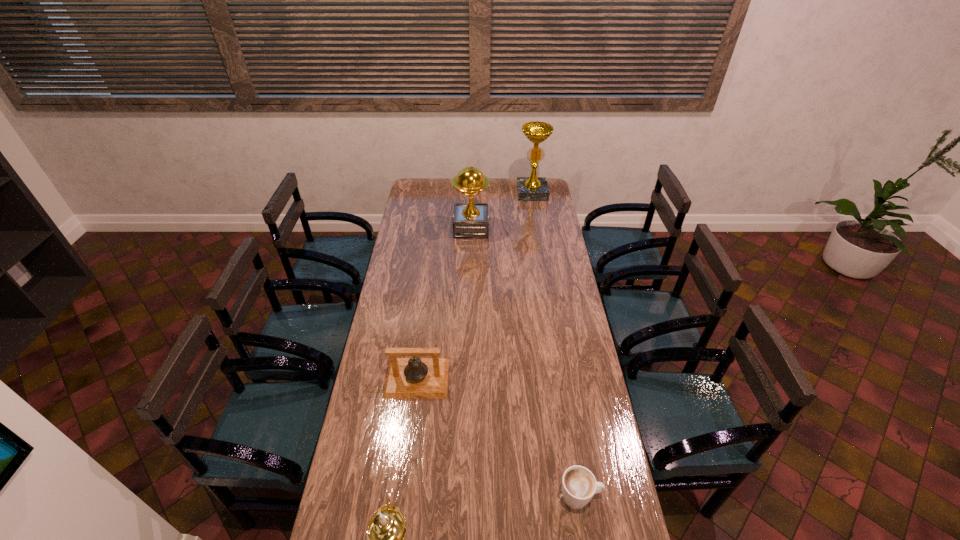
Where is `the right award`? the right award is located at coordinates (533, 188).

I want to click on the farther award, so click(533, 188).

Locate an element on the screen. the second farthest object is located at coordinates (470, 220).

Find the location of a particular element. This screenshot has height=540, width=960. the left award is located at coordinates (470, 220).

The width and height of the screenshot is (960, 540). Find the location of `bell`. bell is located at coordinates (407, 378).

The width and height of the screenshot is (960, 540). I want to click on the third shortest object, so click(407, 378).

The width and height of the screenshot is (960, 540). What are the coordinates of `cappuccino` in the screenshot? It's located at (579, 485).

Find the location of `vacant space located on the front-facing side of the right award`. vacant space located on the front-facing side of the right award is located at coordinates click(x=535, y=211).

You are a GUI agent. You are given a task and a screenshot of the screen. Output one action in this format:
    pyautogui.click(x=<x>, y=<y>)
    Task: Click on the free space located on the front-facing side of the left award
    Image resolution: width=960 pixels, height=540 pixels.
    Given the screenshot: What is the action you would take?
    pyautogui.click(x=535, y=228)

Identify the location of vacant region located on the right of the bell. (511, 379).